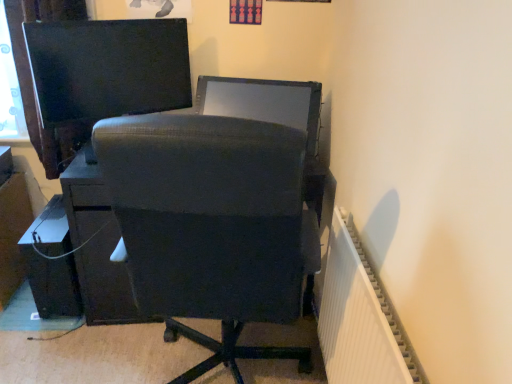
This screenshot has width=512, height=384. What do you see at coordinates (12, 224) in the screenshot?
I see `matte black file cabinet at lower left` at bounding box center [12, 224].

Locate an element on the screen. matte black file cabinet at lower left is located at coordinates click(x=12, y=224).

In order to face matte black chair at center, should I rotate leftwards or rightwards?

Turn left by 3.154 degrees to look at matte black chair at center.

Describe the element at coordinates (264, 102) in the screenshot. This screenshot has height=384, width=512. I see `satin black monitor at center, which is counted as the 1th computer monitor, starting from the right` at that location.

Describe the element at coordinates (359, 318) in the screenshot. I see `white ribbed radiator at right` at that location.

Image resolution: width=512 pixels, height=384 pixels. Identify the location of matte black file cabinet at lower left. (12, 224).

From the image's perspective, which is above, satin black monitor at center, which is counted as the 1th computer monitor, starting from the right, or white ribbed radiator at right?

From the image's view, satin black monitor at center, which is counted as the 1th computer monitor, starting from the right, is above.

Considering the positions of point (278, 111) and point (342, 344), is point (278, 111) closer or farther from the camera than point (342, 344)?

Point (278, 111) is farther from the camera than point (342, 344).

From a real-world perspective, is satin black monitor at center, which is counted as the 1th computer monitor, starting from the right, positioned over white ribbed radiator at right based on gravity?

Yes.

Considering the positions of objects satin black monitor at center, the second computer monitor in the left-to-right sequence, and white ribbed radiator at right in the image provided, who is more to the left, satin black monitor at center, the second computer monitor in the left-to-right sequence, or white ribbed radiator at right?

satin black monitor at center, the second computer monitor in the left-to-right sequence, is more to the left.

From the image's perspective, is matte black file cabinet at lower left on top of matte black monitor at upper left, which appears as the 2th computer monitor when viewed from the right?

Incorrect, from the image's perspective, matte black file cabinet at lower left is lower than matte black monitor at upper left, which appears as the 2th computer monitor when viewed from the right.

Could you tell me if matte black file cabinet at lower left is facing matte black monitor at upper left, which ranks as the 1th computer monitor in left-to-right order?

No, matte black file cabinet at lower left is not turned towards matte black monitor at upper left, which ranks as the 1th computer monitor in left-to-right order.

From a real-world perspective, is matte black file cabinet at lower left located higher than matte black monitor at upper left, which appears as the 2th computer monitor when viewed from the right?

No, from a real-world perspective, matte black file cabinet at lower left is not over matte black monitor at upper left, which appears as the 2th computer monitor when viewed from the right

There is a matte black file cabinet at lower left. At what (x,y) coordinates should I click in order to perform the action: click on the 2nd computer monitor above it (from a real-world perspective). Please return your answer as a coordinate pair (x, y). The height and width of the screenshot is (384, 512). Looking at the image, I should click on (108, 68).

Is matte black file cabinet at lower left inside the boundaries of satin black monitor at center, the second computer monitor in the left-to-right sequence, or outside?

matte black file cabinet at lower left is not enclosed by satin black monitor at center, the second computer monitor in the left-to-right sequence.

Is there a large distance between matte black file cabinet at lower left and satin black monitor at center, which is counted as the 1th computer monitor, starting from the right?

matte black file cabinet at lower left is far away from satin black monitor at center, which is counted as the 1th computer monitor, starting from the right.

From a real-world perspective, which is physically below, matte black file cabinet at lower left or satin black monitor at center, which is counted as the 1th computer monitor, starting from the right?

matte black file cabinet at lower left.

Is point (8, 297) closer or farther from the camera than point (260, 110)?

Point (8, 297) appears to be farther away from the viewer than point (260, 110).

The image size is (512, 384). In order to click on radiator that appears on the right of matte black monitor at upper left, which ranks as the 1th computer monitor in left-to-right order in this screenshot , I will do `click(359, 318)`.

Is matte black monitor at upper left, which appears as the 2th computer monitor when viewed from the right, directly adjacent to white ribbed radiator at right?

matte black monitor at upper left, which appears as the 2th computer monitor when viewed from the right, is not next to white ribbed radiator at right, and they're not touching.

Can you confirm if matte black monitor at upper left, which ranks as the 1th computer monitor in left-to-right order, is shorter than white ribbed radiator at right?

Correct, matte black monitor at upper left, which ranks as the 1th computer monitor in left-to-right order, is not as tall as white ribbed radiator at right.

Is matte black monitor at upper left, which ranks as the 1th computer monitor in left-to-right order, at the right side of matte black file cabinet at lower left?

Indeed, matte black monitor at upper left, which ranks as the 1th computer monitor in left-to-right order, is positioned on the right side of matte black file cabinet at lower left.

Looking at the image, does matte black monitor at upper left, which appears as the 2th computer monitor when viewed from the right, seem bigger or smaller compared to matte black file cabinet at lower left?

In the image, matte black monitor at upper left, which appears as the 2th computer monitor when viewed from the right, appears to be larger than matte black file cabinet at lower left.

From the picture: Considering the relative sizes of matte black monitor at upper left, which appears as the 2th computer monitor when viewed from the right, and matte black file cabinet at lower left in the image provided, is matte black monitor at upper left, which appears as the 2th computer monitor when viewed from the right, wider than matte black file cabinet at lower left?

Incorrect, the width of matte black monitor at upper left, which appears as the 2th computer monitor when viewed from the right, does not surpass that of matte black file cabinet at lower left.

Who is bigger, white ribbed radiator at right or matte black cable at lower left?

white ribbed radiator at right is bigger.

Are white ribbed radiator at right and matte black cable at lower left making contact?

They are not placed beside each other.

Can you confirm if white ribbed radiator at right is positioned to the left of matte black cable at lower left?

No, white ribbed radiator at right is not to the left of matte black cable at lower left.

Measure the distance between matte black cable at lower left and matte black monitor at upper left, which ranks as the 1th computer monitor in left-to-right order.

matte black cable at lower left and matte black monitor at upper left, which ranks as the 1th computer monitor in left-to-right order, are 24.73 inches apart from each other.

This screenshot has width=512, height=384. What are the coordinates of `furniture below the matte black monitor at upper left, which appears as the 2th computer monitor when viewed from the right (from a real-world perspective)` in the screenshot? It's located at (51, 263).

Consider the image. Is matte black cable at lower left smaller than matte black monitor at upper left, which ranks as the 1th computer monitor in left-to-right order?

Indeed, matte black cable at lower left has a smaller size compared to matte black monitor at upper left, which ranks as the 1th computer monitor in left-to-right order.

Is matte black cable at lower left completely or partially outside of matte black monitor at upper left, which ranks as the 1th computer monitor in left-to-right order?

Yes, matte black cable at lower left is not within matte black monitor at upper left, which ranks as the 1th computer monitor in left-to-right order.

Find the location of a particular element. Image resolution: width=512 pixels, height=384 pixels. radiator that appears on the right of satin black monitor at center, the second computer monitor in the left-to-right sequence is located at coordinates (359, 318).

Which computer monitor is the 2nd one when counting from the front of the matte black file cabinet at lower left? Please provide its 2D coordinates.

[(108, 68)]

Based on their spatial positions, is matte black file cabinet at lower left or matte black monitor at upper left, which appears as the 2th computer monitor when viewed from the right, further from matte black chair at center?

matte black file cabinet at lower left is positioned further to the anchor matte black chair at center.

From the image, which object appears to be nearer to matte black chair at center, matte black cable at lower left or white ribbed radiator at right?

white ribbed radiator at right lies closer to matte black chair at center than the other object.

Considering their positions, is matte black file cabinet at lower left positioned further to white ribbed radiator at right than matte black chair at center?

matte black file cabinet at lower left.

When comparing their distances from white ribbed radiator at right, does matte black file cabinet at lower left or satin black monitor at center, which is counted as the 1th computer monitor, starting from the right, seem further?

matte black file cabinet at lower left lies further to white ribbed radiator at right than the other object.

Which object lies nearer to the anchor point matte black cable at lower left, matte black chair at center or satin black monitor at center, the second computer monitor in the left-to-right sequence?

Based on the image, matte black chair at center appears to be nearer to matte black cable at lower left.

Based on their spatial positions, is satin black monitor at center, the second computer monitor in the left-to-right sequence, or matte black monitor at upper left, which appears as the 2th computer monitor when viewed from the right, closer to matte black file cabinet at lower left?

matte black monitor at upper left, which appears as the 2th computer monitor when viewed from the right, lies closer to matte black file cabinet at lower left than the other object.

From the image, which object appears to be farther from satin black monitor at center, which is counted as the 1th computer monitor, starting from the right, matte black monitor at upper left, which ranks as the 1th computer monitor in left-to-right order, or matte black chair at center?

matte black chair at center is positioned further to the anchor satin black monitor at center, which is counted as the 1th computer monitor, starting from the right.

When comparing their distances from matte black cable at lower left, does matte black file cabinet at lower left or matte black monitor at upper left, which ranks as the 1th computer monitor in left-to-right order, seem closer?

matte black file cabinet at lower left is positioned closer to the anchor matte black cable at lower left.

Where is `furniture between matte black file cabinet at lower left and white ribbed radiator at right from left to right`? furniture between matte black file cabinet at lower left and white ribbed radiator at right from left to right is located at coordinates pyautogui.click(x=51, y=263).

Locate an element on the screen. Image resolution: width=512 pixels, height=384 pixels. furniture between matte black file cabinet at lower left and matte black chair at center is located at coordinates (51, 263).

Image resolution: width=512 pixels, height=384 pixels. In order to click on file cabinet between matte black monitor at upper left, which appears as the 2th computer monitor when viewed from the right, and matte black cable at lower left from top to bottom in this screenshot , I will do `click(12, 224)`.

Locate an element on the screen. chair between matte black cable at lower left and satin black monitor at center, which is counted as the 1th computer monitor, starting from the right is located at coordinates (209, 224).